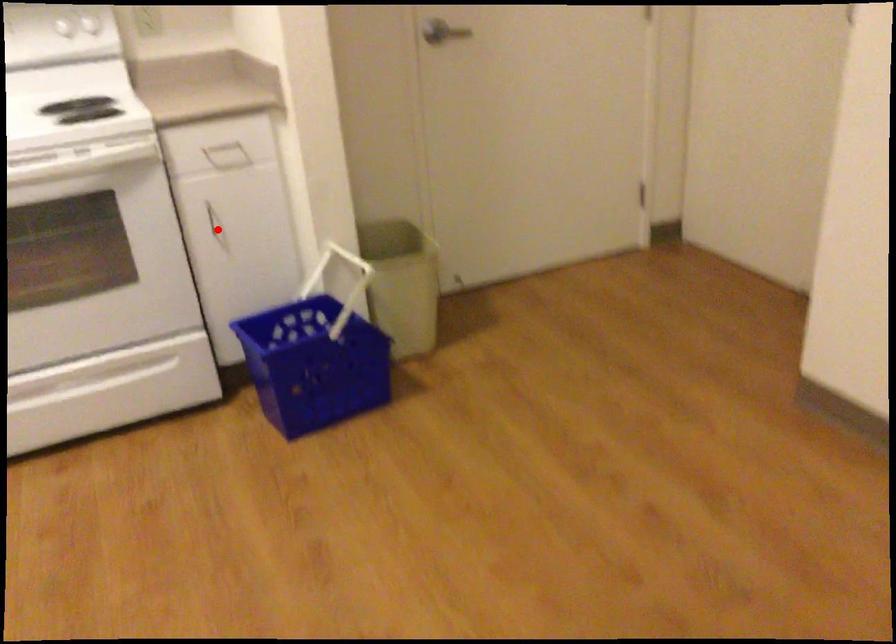
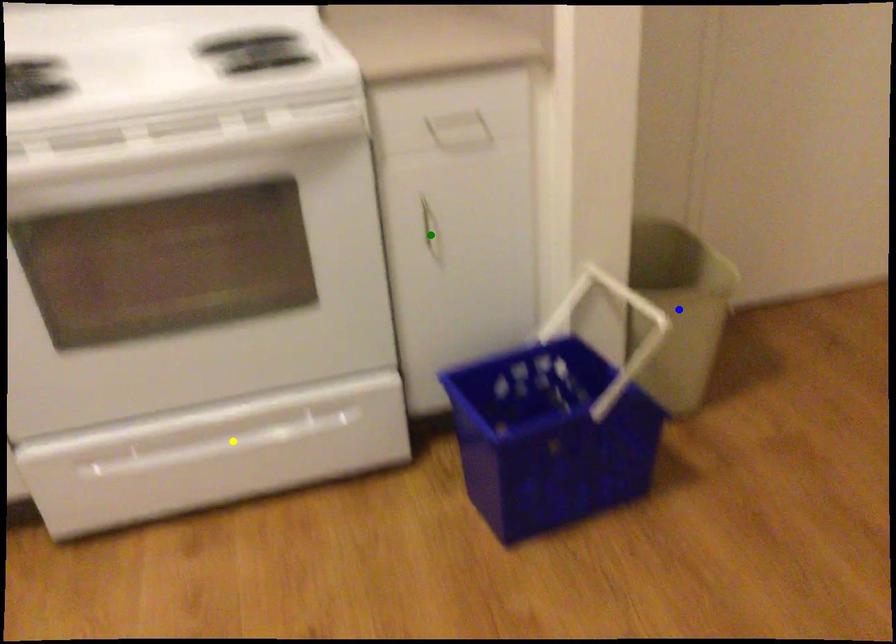
Question: I am providing you with two images of the same scene from different viewpoints. A red point is marked on the first image. You are given multiple points on the second image. Which mark in image 2 goes with the point in image 1?

Choices:
 (A) yellow point
 (B) blue point
 (C) green point

Answer: (C)